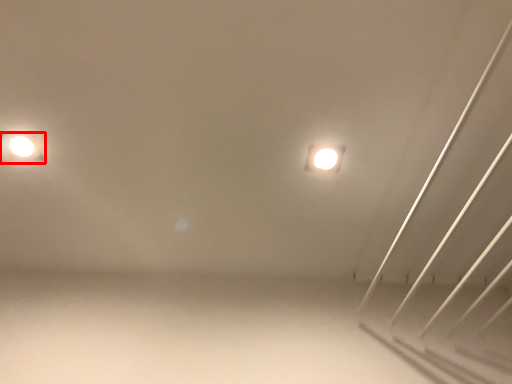
Question: Considering the relative positions of lamp (annotated by the red box) and lamp in the image provided, where is lamp (annotated by the red box) located with respect to the staircase?

Choices:
 (A) left
 (B) right

Answer: (A)